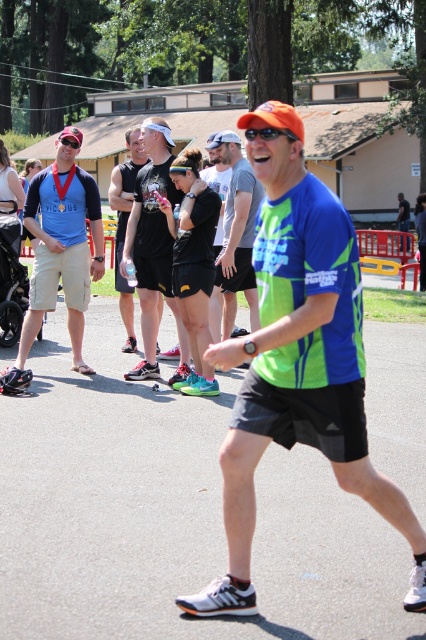
Based on the photo, you are a photographer at the event and want to capture a photo that includes both the matte blue shirt at left and the neon green jersey at center. Based on their positions, which shirt should you focus on first to ensure both are in the frame?

The matte blue shirt at left is positioned on the left side of neon green jersey at center, so you should focus on the neon green jersey at center first to ensure both are in the frame.

You are standing at the starting line of the race and see two points marked on the path ahead. The first point is at coordinate point (416,538) and the second is at coordinate point (123,237). Which point is closer to you?

Point (416,538) is closer to the viewer than point (123,237), so the first point is closer to you.

Based on the photo, you are a photographer at the event and want to capture a photo that includes both the matte blue shirt at left and the black athletic shorts at center. Which object should you adjust your camera focus to first to ensure both are in frame?

The matte blue shirt at left is smaller in size compared to the black athletic shorts at center, so you should focus on the larger object first to ensure both fit within the frame.